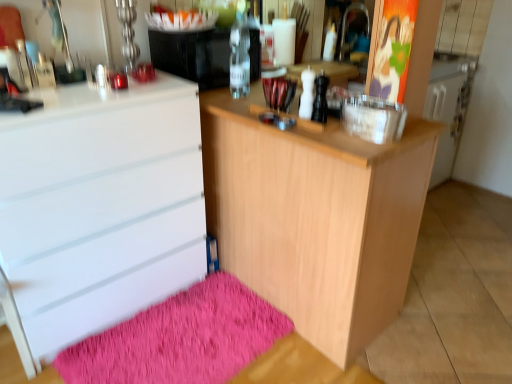
Question: Can white glossy chest of drawers at left be found inside clear glass bottle at center?

Choices:
 (A) no
 (B) yes

Answer: (A)

Question: From a real-world perspective, is clear glass bottle at center physically below white glossy chest of drawers at left?

Choices:
 (A) yes
 (B) no

Answer: (B)

Question: Is the surface of clear glass bottle at center in direct contact with white glossy chest of drawers at left?

Choices:
 (A) yes
 (B) no

Answer: (B)

Question: Considering the relative positions of clear glass bottle at center and white glossy chest of drawers at left in the image provided, is clear glass bottle at center behind white glossy chest of drawers at left?

Choices:
 (A) yes
 (B) no

Answer: (A)

Question: Is clear glass bottle at center smaller than white glossy chest of drawers at left?

Choices:
 (A) no
 (B) yes

Answer: (B)

Question: From the image's perspective, is clear glass water bottle at center located above or below shaggy pink bath mat at lower left?

Choices:
 (A) above
 (B) below

Answer: (A)

Question: In the image, is clear glass water bottle at center positioned in front of or behind shaggy pink bath mat at lower left?

Choices:
 (A) front
 (B) behind

Answer: (B)

Question: In the image, is clear glass water bottle at center on the left side or the right side of shaggy pink bath mat at lower left?

Choices:
 (A) left
 (B) right

Answer: (B)

Question: In terms of size, does clear glass water bottle at center appear bigger or smaller than shaggy pink bath mat at lower left?

Choices:
 (A) small
 (B) big

Answer: (B)

Question: In terms of width, does clear glass bottle at center look wider or thinner when compared to light wood cabinet at center?

Choices:
 (A) wide
 (B) thin

Answer: (B)

Question: Is clear glass bottle at center taller or shorter than light wood cabinet at center?

Choices:
 (A) tall
 (B) short

Answer: (B)

Question: In the image, is clear glass bottle at center on the left side or the right side of light wood cabinet at center?

Choices:
 (A) left
 (B) right

Answer: (A)

Question: Is clear glass bottle at center bigger or smaller than light wood cabinet at center?

Choices:
 (A) small
 (B) big

Answer: (A)

Question: Considering the positions of light wood cabinet at center and shaggy pink bath mat at lower left in the image, is light wood cabinet at center wider or thinner than shaggy pink bath mat at lower left?

Choices:
 (A) wide
 (B) thin

Answer: (A)

Question: In terms of height, does light wood cabinet at center look taller or shorter compared to shaggy pink bath mat at lower left?

Choices:
 (A) tall
 (B) short

Answer: (A)